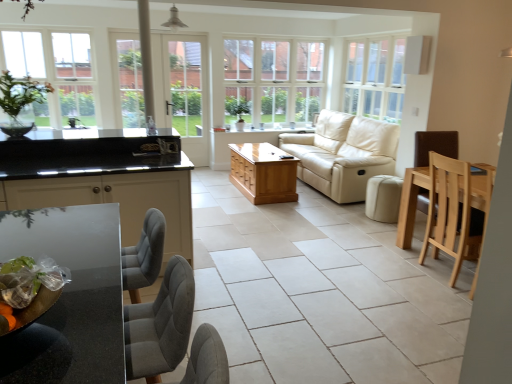
This screenshot has width=512, height=384. Identify the location of free point in front of light brown wooden coffee table at center. (261, 216).